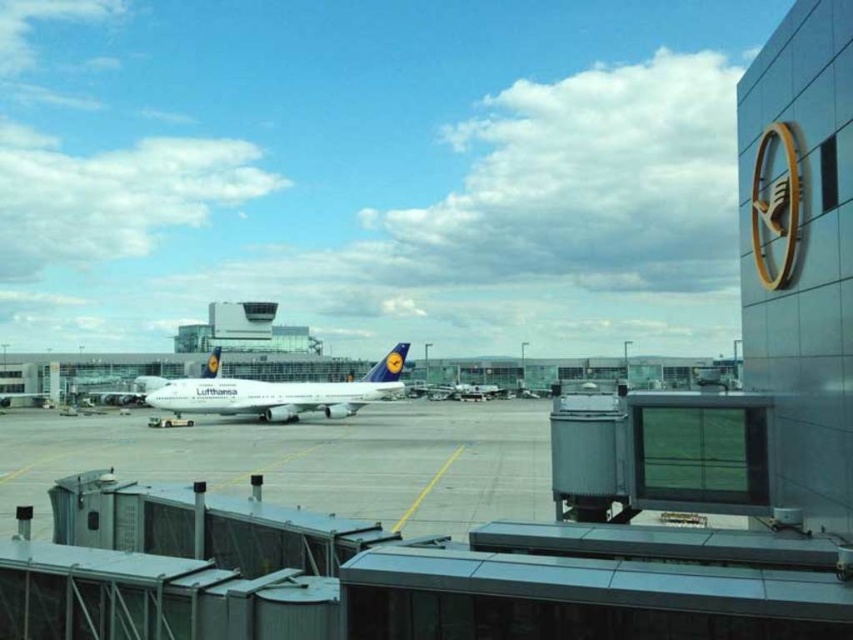
You are an airport maintenance worker who needs to reach a maintenance point located at point [543,458] and another at point [151,384]. Which point is closer to your current position if you are standing at the entrance of the terminal?

Point [543,458] is in front of point [151,384], so it is closer to your current position at the terminal entrance.

You are a pilot taxiing your aircraft toward the terminal. You see the smooth concrete tarmac at center and the white glossy airplane at center. Which direction should you turn to avoid the airplane?

The smooth concrete tarmac at center is to the right of the white glossy airplane at center, so you should turn right to avoid the airplane.